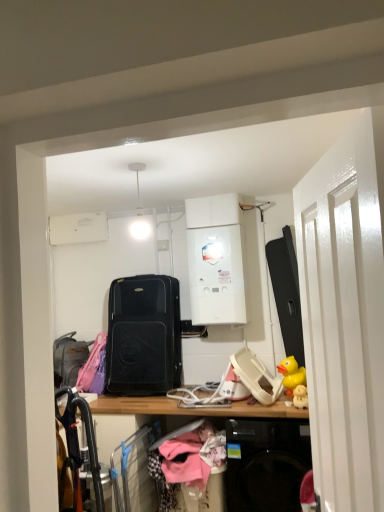
Question: Does yellow rubber duck at right have a lesser width compared to gray fabric suitcase at left?

Choices:
 (A) yes
 (B) no

Answer: (A)

Question: Is yellow rubber duck at right facing away from gray fabric suitcase at left?

Choices:
 (A) yes
 (B) no

Answer: (B)

Question: From the image's perspective, does yellow rubber duck at right appear higher than gray fabric suitcase at left?

Choices:
 (A) no
 (B) yes

Answer: (B)

Question: Is there a large distance between yellow rubber duck at right and gray fabric suitcase at left?

Choices:
 (A) no
 (B) yes

Answer: (B)

Question: Is yellow rubber duck at right positioned in front of gray fabric suitcase at left?

Choices:
 (A) no
 (B) yes

Answer: (B)

Question: Is pink fabric hanger at center bigger or smaller than white glossy door at right?

Choices:
 (A) small
 (B) big

Answer: (A)

Question: Does point (193, 424) appear closer or farther from the camera than point (344, 389)?

Choices:
 (A) closer
 (B) farther

Answer: (B)

Question: In the image, is pink fabric hanger at center positioned in front of or behind white glossy door at right?

Choices:
 (A) front
 (B) behind

Answer: (B)

Question: Considering the positions of pink fabric hanger at center and white glossy door at right in the image, is pink fabric hanger at center wider or thinner than white glossy door at right?

Choices:
 (A) wide
 (B) thin

Answer: (A)

Question: Considering the positions of black matte suitcase at center and yellow rubber duck at right in the image, is black matte suitcase at center taller or shorter than yellow rubber duck at right?

Choices:
 (A) short
 (B) tall

Answer: (B)

Question: In the image, is black matte suitcase at center positioned in front of or behind yellow rubber duck at right?

Choices:
 (A) front
 (B) behind

Answer: (B)

Question: Considering the positions of point (173, 315) and point (297, 382), is point (173, 315) closer or farther from the camera than point (297, 382)?

Choices:
 (A) farther
 (B) closer

Answer: (A)

Question: Is black matte suitcase at center to the left or to the right of yellow rubber duck at right in the image?

Choices:
 (A) left
 (B) right

Answer: (A)

Question: Is gray fabric suitcase at left wider or thinner than black matte suitcase at center?

Choices:
 (A) thin
 (B) wide

Answer: (A)

Question: Based on their positions, is gray fabric suitcase at left located to the left or right of black matte suitcase at center?

Choices:
 (A) right
 (B) left

Answer: (B)